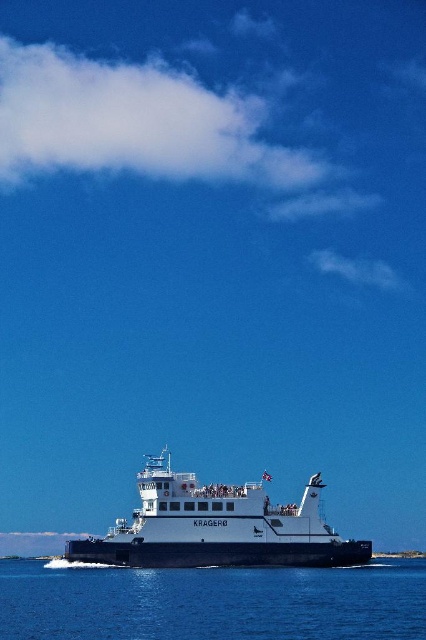
You are a GUI agent. You are given a task and a screenshot of the screen. Output one action in this format:
    pyautogui.click(x=<x>, y=<y>)
    Task: Click on the transparent blue water at lower center
    
    Given the screenshot: What is the action you would take?
    pyautogui.click(x=212, y=602)